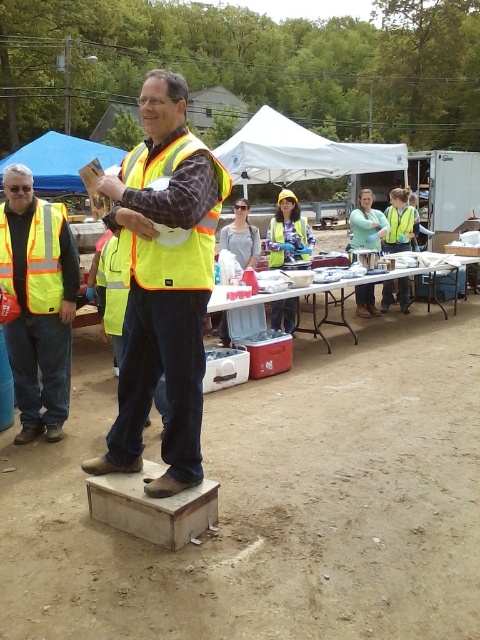
From the picture: You are organizing a safety workshop and need to choose between the yellow reflective vest at center and the high visibility reflective safety vest at left. Which vest is larger in size?

The high visibility reflective safety vest at left is larger in size compared to the yellow reflective vest at center.

You are standing at the origin point of the coordinate system. There is a yellow reflective vest at center located at point (164, 284). Can you determine the direction of the yellow reflective vest at center relative to your position?

The yellow reflective vest at center is located at point (164, 284), which is to the right and slightly below the origin point.